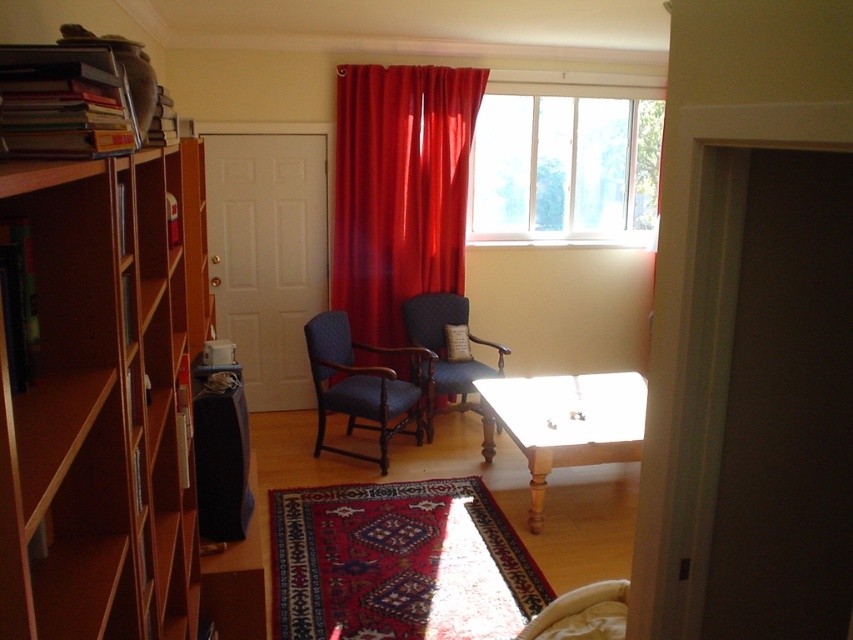
Question: Among these objects, which one is nearest to the camera?

Choices:
 (A) light wood table at center
 (B) transparent glass window at upper center
 (C) dark blue quilted armchair at center
 (D) brown wooden bookcase at left

Answer: (D)

Question: Does transparent glass window at upper center appear on the right side of dark blue quilted armchair at center?

Choices:
 (A) no
 (B) yes

Answer: (B)

Question: Can you confirm if light wood table at center is positioned to the left of dark blue fabric armchair at center?

Choices:
 (A) yes
 (B) no

Answer: (B)

Question: Which point is farther from the camera taking this photo?

Choices:
 (A) (527, 195)
 (B) (447, 282)
 (C) (334, 396)

Answer: (A)

Question: Which point appears closest to the camera in this image?

Choices:
 (A) (114, 516)
 (B) (608, 432)

Answer: (A)

Question: Does velvet red curtain at center appear over transparent glass window at upper center?

Choices:
 (A) yes
 (B) no

Answer: (B)